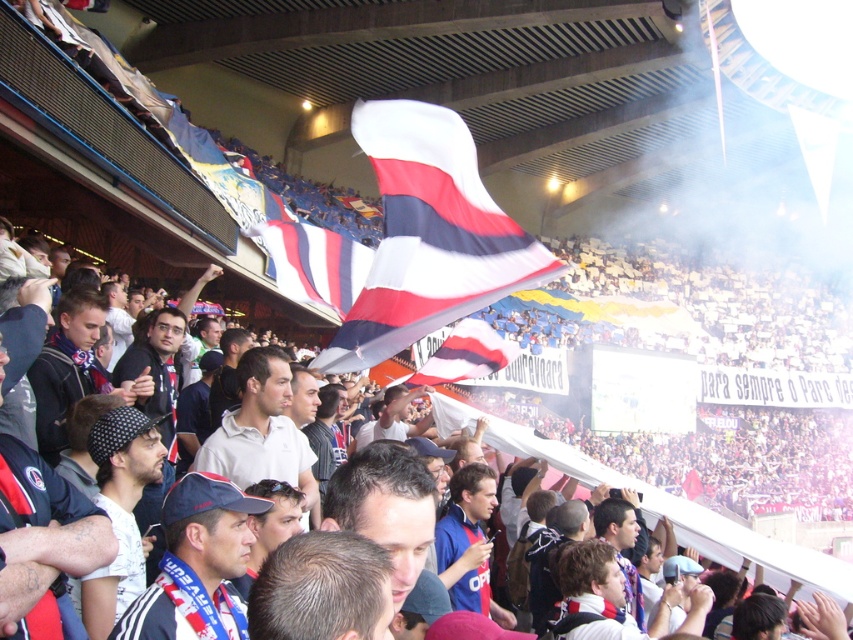
Question: Which object is positioned closest to the white matte shirt at center?

Choices:
 (A) white/red striped flag at center
 (B) white cotton shirt at center
 (C) light brown hair at center
 (D) dark brown hair at center

Answer: (B)

Question: Which point is farther from the camera taking this photo?

Choices:
 (A) (331, 556)
 (B) (244, 419)
 (C) (222, 621)

Answer: (B)

Question: Is white matte shirt at center smaller than blue jersey at center?

Choices:
 (A) yes
 (B) no

Answer: (B)

Question: Can you confirm if white fabric flag at upper center is wider than white cotton shirt at center?

Choices:
 (A) yes
 (B) no

Answer: (A)

Question: Which of the following is the farthest from the observer?

Choices:
 (A) dark brown hair at center
 (B) white/red striped flag at center

Answer: (B)

Question: Is white fabric flag at upper center closer to the viewer compared to blue jersey at center?

Choices:
 (A) no
 (B) yes

Answer: (B)